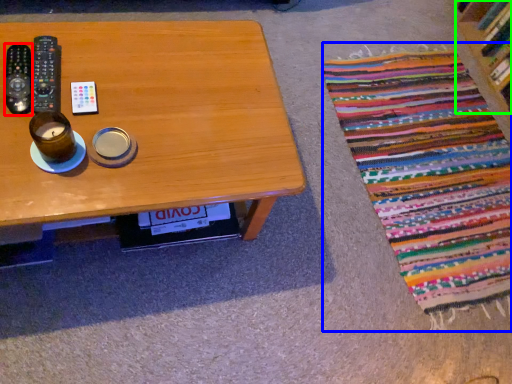
Question: Estimate the real-world distances between objects in this image. Which object is closer to remote control (highlighted by a red box), blanket (highlighted by a blue box) or shelf (highlighted by a green box)?

Choices:
 (A) blanket
 (B) shelf

Answer: (A)